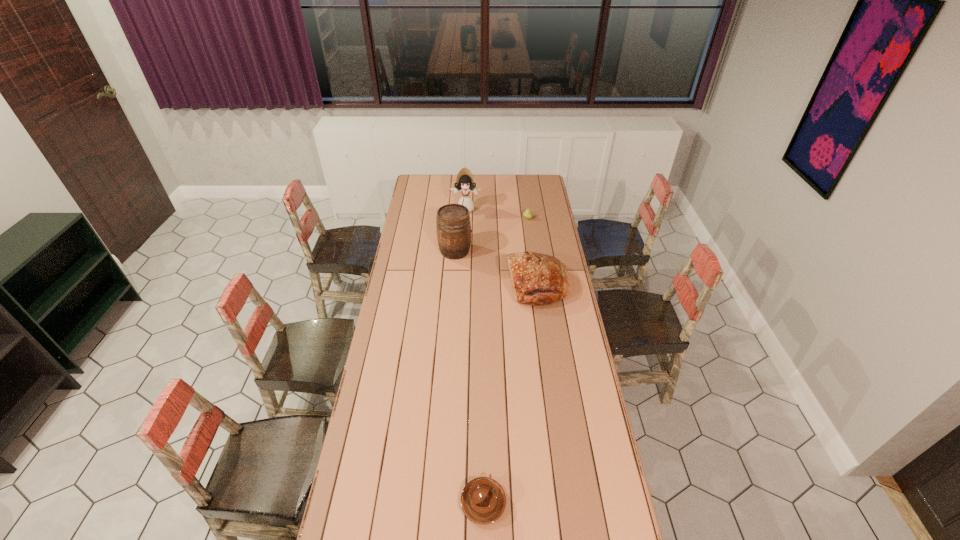
Find the location of a particular element. Image resolution: width=960 pixels, height=540 pixels. object that stands as the fourth closest to the doll is located at coordinates (483, 500).

Identify which object is the fourth nearest to the doll. Please provide its 2D coordinates. Your answer should be formatted as a tuple, i.e. [(x, y)], where the tuple contains the x and y coordinates of a point satisfying the conditions above.

[(483, 500)]

The width and height of the screenshot is (960, 540). I want to click on vacant area in the image that satisfies the following two spatial constraints: 1. on the side of the nearest object with the handle; 2. on the side of the third farthest object near the bung hole, so (x=482, y=251).

This screenshot has width=960, height=540. Find the location of `free space that satisfies the following two spatial constraints: 1. on the side of the shortest object with the handle; 2. on the side of the cider near the bung hole`. free space that satisfies the following two spatial constraints: 1. on the side of the shortest object with the handle; 2. on the side of the cider near the bung hole is located at coordinates (482, 251).

The image size is (960, 540). What are the coordinates of `vacant area in the image that satisfies the following two spatial constraints: 1. on the front side of the second shortest object; 2. at the sliced front of the bread` in the screenshot? It's located at (538, 286).

Locate an element on the screen. This screenshot has height=540, width=960. vacant point that satisfies the following two spatial constraints: 1. at the front face of the doll; 2. on the side of the third nearest object near the bung hole is located at coordinates (465, 251).

Locate an element on the screen. This screenshot has height=540, width=960. vacant space that satisfies the following two spatial constraints: 1. at the front face of the farthest object; 2. on the right side of the fourth tallest object is located at coordinates (466, 218).

This screenshot has width=960, height=540. Find the location of `vacant space that satisfies the following two spatial constraints: 1. on the side of the fourth nearest object with the handle; 2. on the left side of the nearest object`. vacant space that satisfies the following two spatial constraints: 1. on the side of the fourth nearest object with the handle; 2. on the left side of the nearest object is located at coordinates (482, 218).